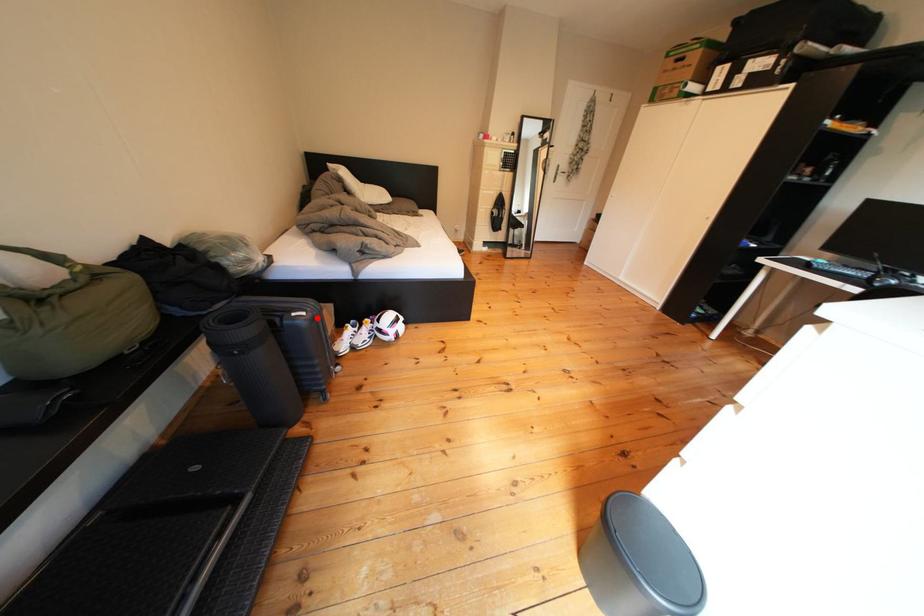
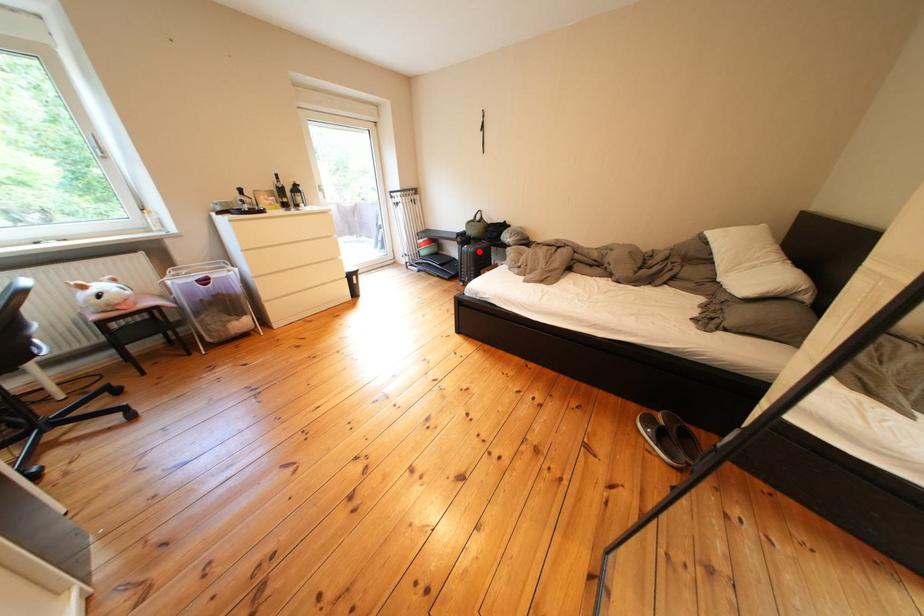
I am providing you with two images of the same scene from different viewpoints. A red point is marked on the first image and another point is marked on the second image. Do the highlighted points in image1 and image2 indicate the same real-world spot?

Yes